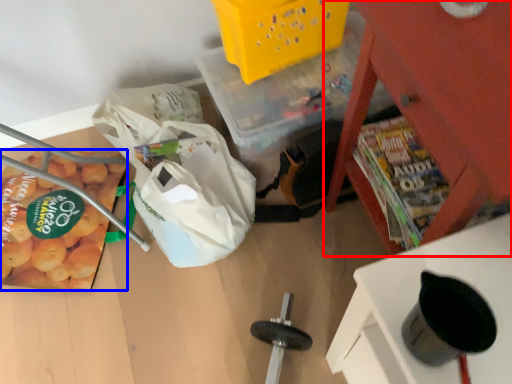
Question: Among these objects, which one is farthest to the camera, furniture (highlighted by a red box) or vegetable (highlighted by a blue box)?

Choices:
 (A) furniture
 (B) vegetable

Answer: (B)